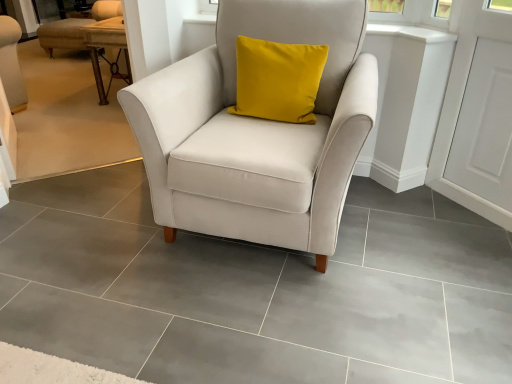
Question: Can white smooth window sill at upper center be found inside satin white armchair at center?

Choices:
 (A) yes
 (B) no

Answer: (B)

Question: Considering the relative sizes of satin white armchair at center and white smooth window sill at upper center in the image provided, is satin white armchair at center smaller than white smooth window sill at upper center?

Choices:
 (A) no
 (B) yes

Answer: (A)

Question: Is satin white armchair at center to the right of white smooth window sill at upper center from the viewer's perspective?

Choices:
 (A) no
 (B) yes

Answer: (A)

Question: Is white smooth window sill at upper center at the back of satin white armchair at center?

Choices:
 (A) no
 (B) yes

Answer: (A)

Question: From a real-world perspective, is satin white armchair at center positioned over white smooth window sill at upper center based on gravity?

Choices:
 (A) no
 (B) yes

Answer: (A)

Question: Based on their positions, is white smooth window sill at upper center located to the left or right of satin white armchair at center?

Choices:
 (A) left
 (B) right

Answer: (B)

Question: Is white smooth window sill at upper center spatially inside satin white armchair at center, or outside of it?

Choices:
 (A) inside
 (B) outside

Answer: (B)

Question: From their relative heights in the image, would you say white smooth window sill at upper center is taller or shorter than satin white armchair at center?

Choices:
 (A) tall
 (B) short

Answer: (B)

Question: Based on their sizes in the image, would you say white smooth window sill at upper center is bigger or smaller than satin white armchair at center?

Choices:
 (A) big
 (B) small

Answer: (B)

Question: Which is correct: wooden textured table at upper left is inside white smooth window sill at upper center, or outside of it?

Choices:
 (A) inside
 (B) outside

Answer: (B)

Question: Relative to white smooth window sill at upper center, is wooden textured table at upper left in front or behind?

Choices:
 (A) behind
 (B) front

Answer: (A)

Question: Is wooden textured table at upper left taller or shorter than white smooth window sill at upper center?

Choices:
 (A) tall
 (B) short

Answer: (A)

Question: Does point (108, 21) appear closer or farther from the camera than point (451, 36)?

Choices:
 (A) closer
 (B) farther

Answer: (B)

Question: In terms of height, does satin white armchair at center look taller or shorter compared to white smooth window sill at upper center?

Choices:
 (A) tall
 (B) short

Answer: (A)

Question: From a real-world perspective, is satin white armchair at center positioned above or below white smooth window sill at upper center?

Choices:
 (A) above
 (B) below

Answer: (B)